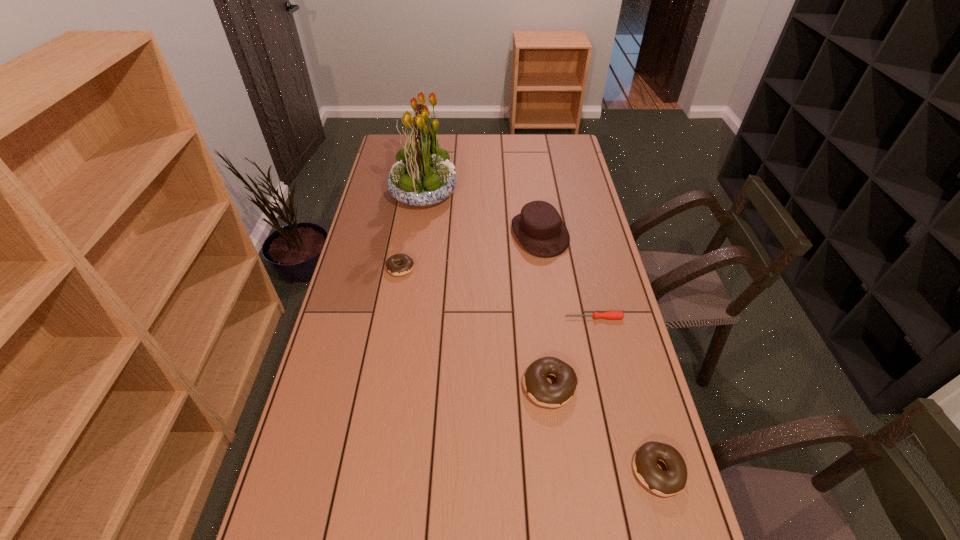
Identify the location of vacant space that's between the fifth shortest object and the third nearest object. (566, 276).

The image size is (960, 540). I want to click on empty space that is in between the flower arrangement and the leftmost doughnut, so click(412, 230).

The height and width of the screenshot is (540, 960). What are the coordinates of `unoccupied area between the second tallest object and the shortest object` in the screenshot? It's located at (566, 276).

Where is `vacant space that's between the second doughnut from right to left and the shortest doughnut`? This screenshot has height=540, width=960. vacant space that's between the second doughnut from right to left and the shortest doughnut is located at coordinates (475, 327).

In order to click on free area in between the tallest object and the second tallest object in this screenshot , I will do `click(482, 213)`.

In order to click on free space between the third shortest object and the second doughnut from left to right in this screenshot , I will do `click(604, 428)`.

Select which object is the second closest to the tallest object. Please provide its 2D coordinates. Your answer should be formatted as a tuple, i.e. [(x, y)], where the tuple contains the x and y coordinates of a point satisfying the conditions above.

[(392, 262)]

Identify the location of object that is the fourth nearest to the tallest object. (535, 382).

At what (x,y) coordinates should I click in order to perform the action: click on doughnut that is the second closest to the third shortest object. Please return your answer as a coordinate pair (x, y). Looking at the image, I should click on (392, 262).

Locate which doughnut is the second closest to the flower arrangement. Please provide its 2D coordinates. Your answer should be formatted as a tuple, i.e. [(x, y)], where the tuple contains the x and y coordinates of a point satisfying the conditions above.

[(535, 382)]